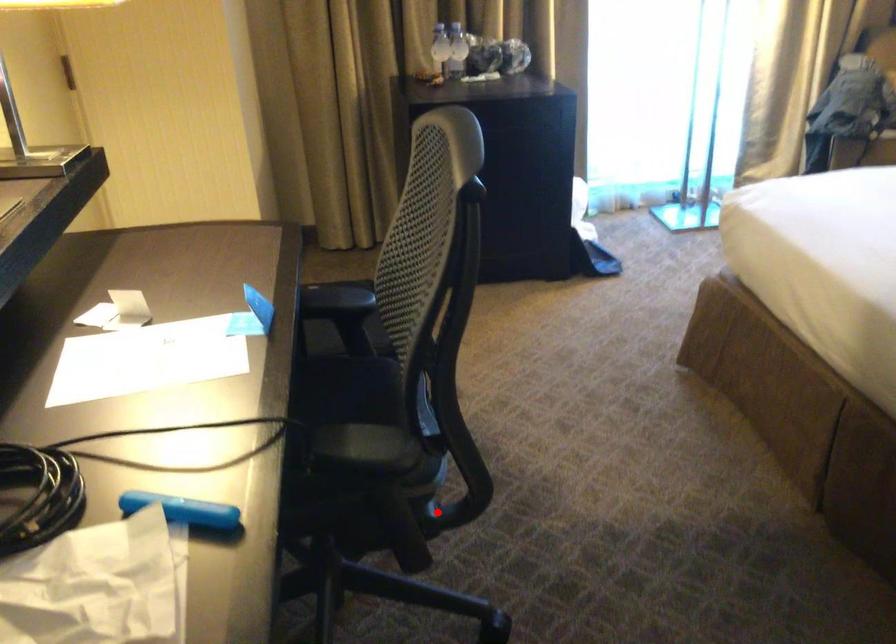
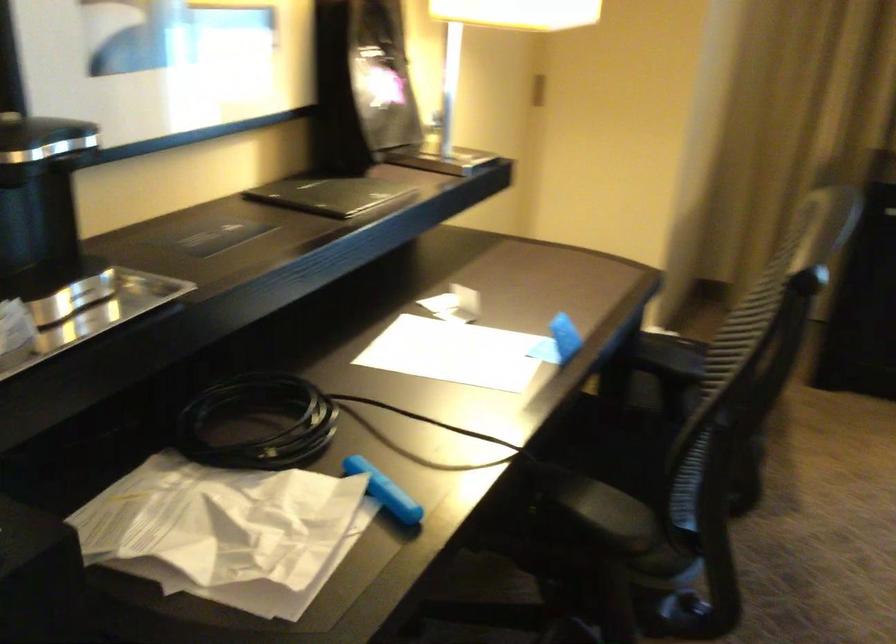
Where in the second image is the point corresponding to the highlighted location from the first image?

(679, 614)